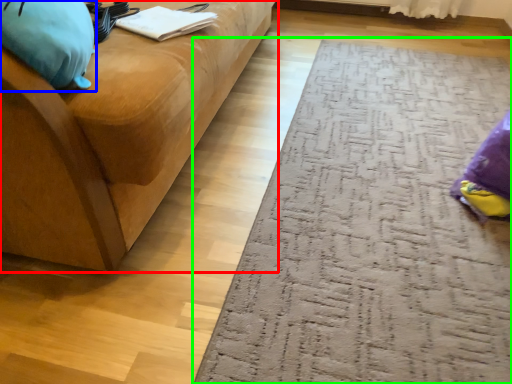
Question: Based on their relative distances, which object is farther from studio couch (highlighted by a red box)? Choose from bean bag chair (highlighted by a blue box) and doormat (highlighted by a green box).

Choices:
 (A) bean bag chair
 (B) doormat

Answer: (B)